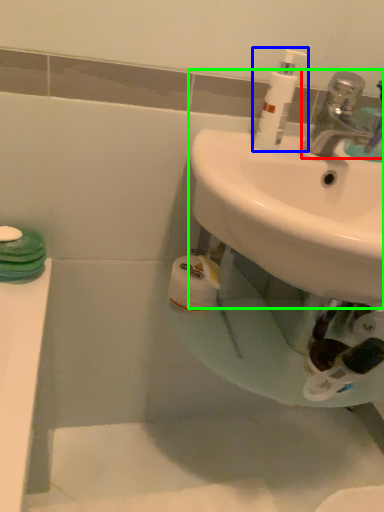
Question: Which object is positioned closest to tap (highlighted by a red box)? Select from cleaning product (highlighted by a blue box) and sink (highlighted by a green box).

Choices:
 (A) cleaning product
 (B) sink

Answer: (A)